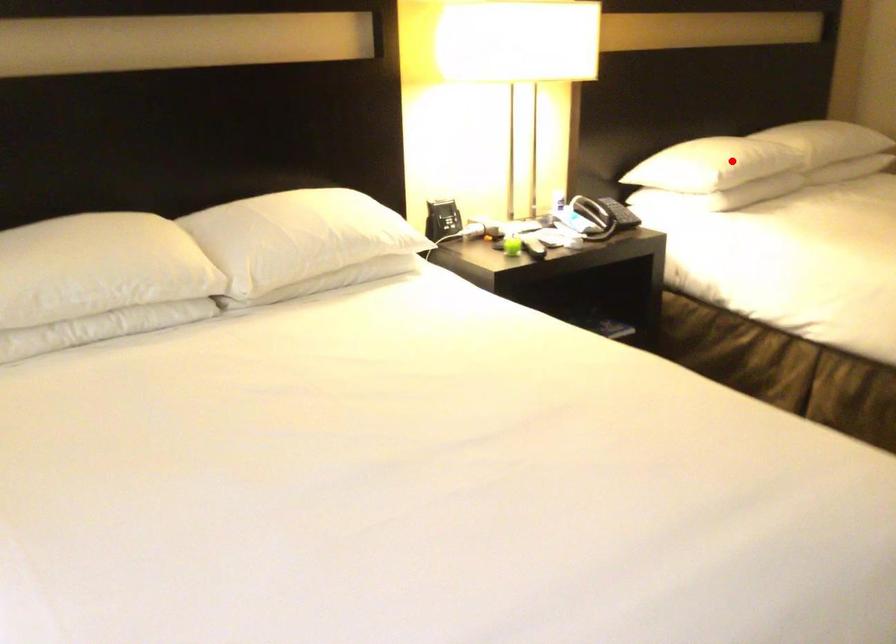
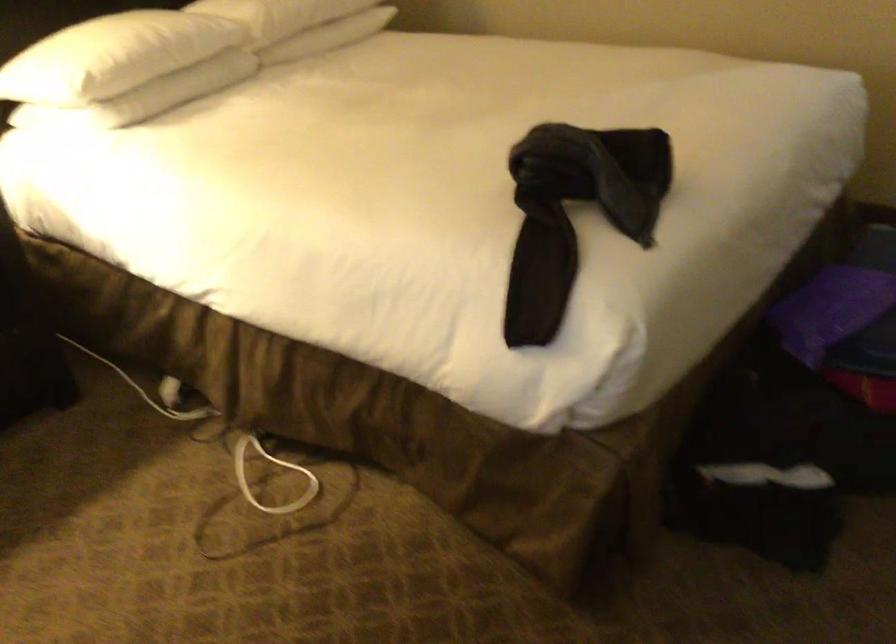
Question: I am providing you with two images of the same scene from different viewpoints. Image1 has a red point marked. In image2, the corresponding 3D location appears at what relative position? Reply with the corresponding letter.

Choices:
 (A) Closer
 (B) Farther

Answer: (A)